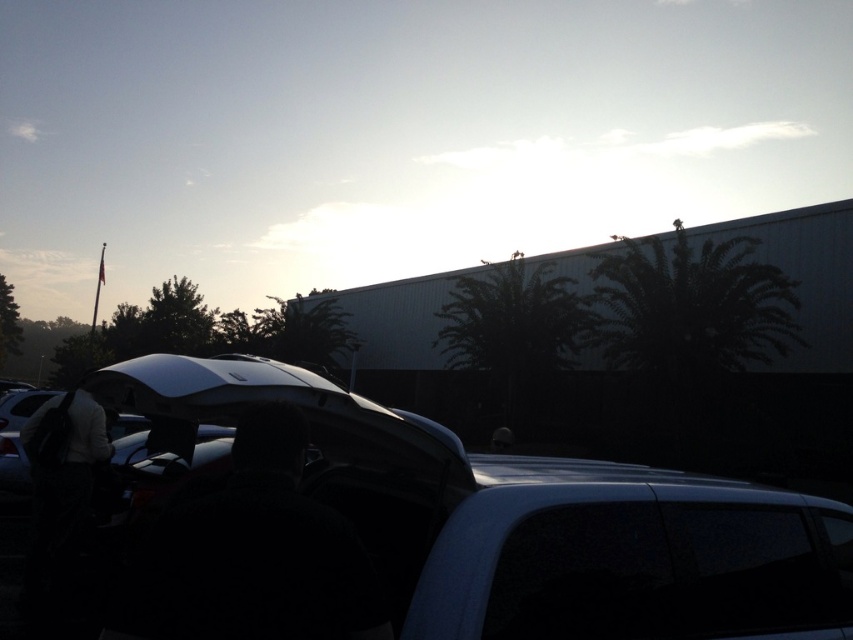
You are trying to locate the glossy black car at center in a parking lot. Given the coordinates provided in the Objects Description, can you determine its position relative to the other cars?

Result: The glossy black car at center is located at point coordinates, but the coordinates of other cars are not provided, so I cannot determine its exact position relative to them.